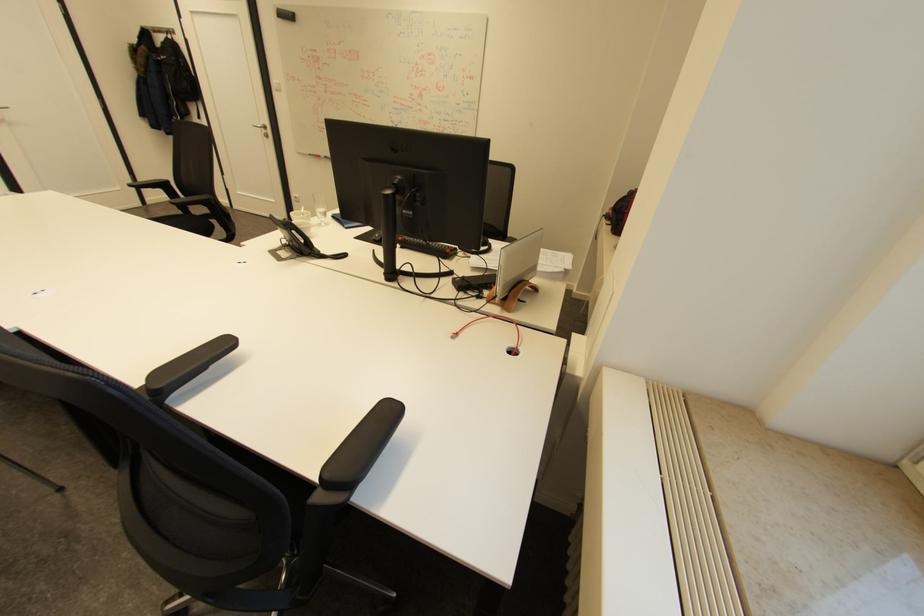
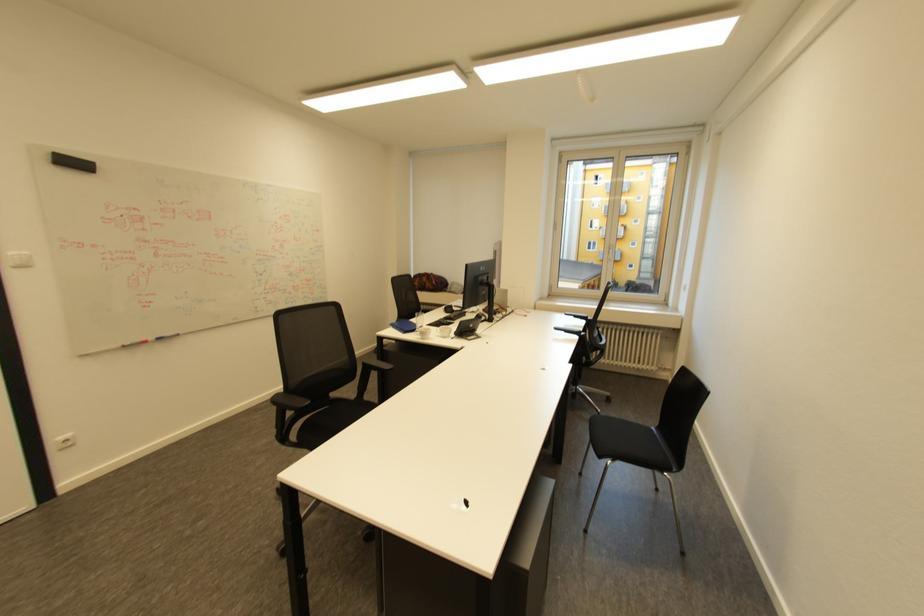
In the second image, find the point that corresponds to [333,156] in the first image.

(164, 339)